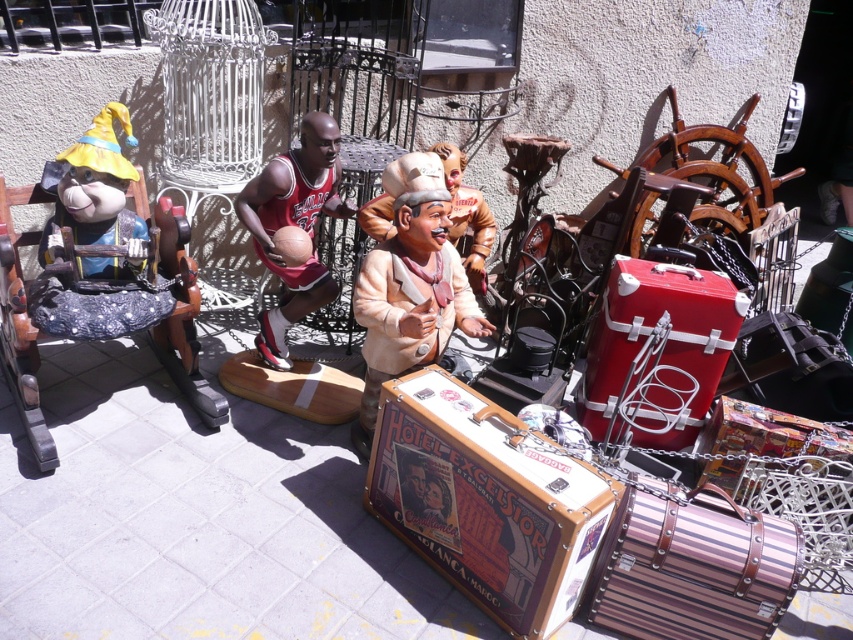
Consider the image. You are standing at the center of the flea market scene. There is a point marked at coordinates (410, 284). What object is located at this point?

The brown matte statue at center is located at point (410, 284).

You are setting up a display at a flea market and want to place the brown matte statue at center and the red jersey basketball player at center side by side. Which object should you place first to ensure they fit properly?

You should place the brown matte statue at center first since it is wider than the red jersey basketball player at center, ensuring there is enough space for both.